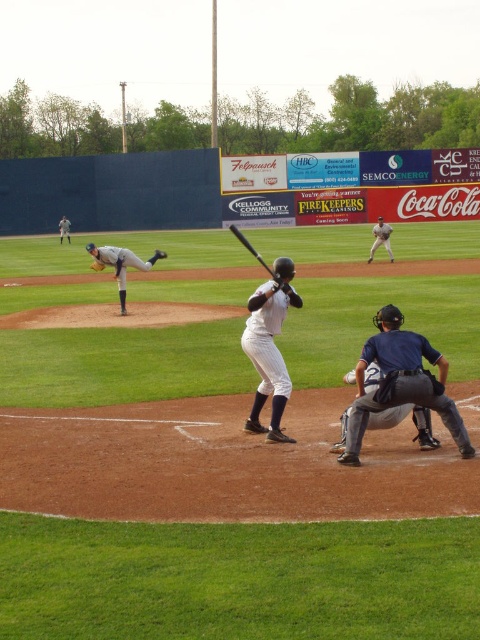
Measure the distance between point (282, 292) and camera.

A distance of 24.12 feet exists between point (282, 292) and camera.

Does point (264, 390) come farther from viewer compared to point (156, 253)?

No, (264, 390) is in front of (156, 253).

Is point (266, 385) positioned before point (157, 250)?

Yes, point (266, 385) is closer to viewer.

Locate an element on the screen. This screenshot has height=640, width=480. white matte baseball bat at center is located at coordinates (269, 346).

Is white matte baseball bat at center to the right of white uniformed pitcher at left from the viewer's perspective?

Correct, you'll find white matte baseball bat at center to the right of white uniformed pitcher at left.

Who is more forward, (277,353) or (63,224)?

Point (277,353) is in front.

In order to click on white matte baseball bat at center in this screenshot , I will do `click(269, 346)`.

Consider the image. Is gray uniformed pitcher at center positioned before brown leather glove at center?

Yes, it is.

Measure the distance between point (x=119, y=296) and camera.

Point (x=119, y=296) and camera are 17.56 meters apart from each other.

The image size is (480, 640). I want to click on gray uniformed pitcher at center, so click(119, 266).